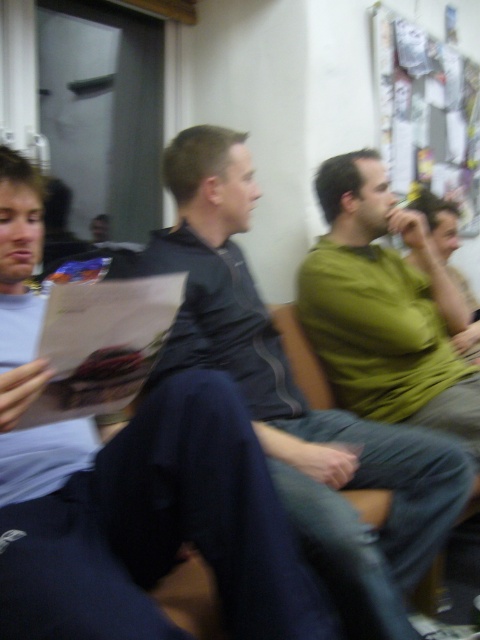
You are organizing a photo shoot and need to arrange two shirts in a display case. The shirts are the dark gray fabric shirt at center and the green matte shirt at center. Based on their positions in the image, which shirt should be placed higher to maintain the same visual hierarchy as shown?

The dark gray fabric shirt at center should be placed higher in the display case since it has a greater height compared to the green matte shirt at center, maintaining the visual hierarchy from the image.

You are standing in the room and want to move from the point at coordinates point (152, 410) to the point at coordinates point (216, 189). Which direction should you move in?

You should move backward since point (152, 410) is in front of point (216, 189). Moving backward from point (152, 410) will bring you closer to point (216, 189).